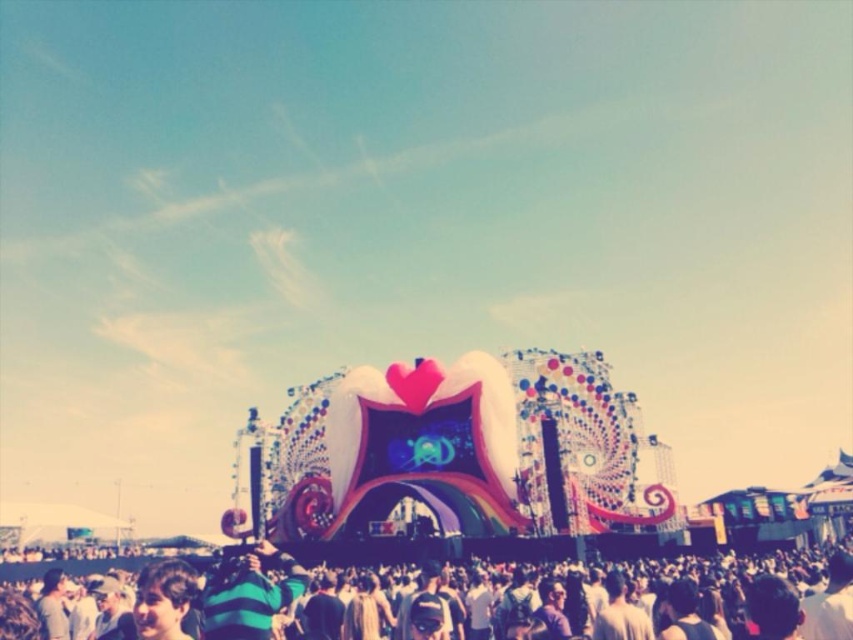
You are a drone operator who needs to fly a drone from the shiny metallic heart at center to the dark gray fabric crowd at lower center. The drone has a maximum flight range of 20 meters. Can the drone complete the flight without needing to recharge?

The shiny metallic heart at center is 22.82 meters from the dark gray fabric crowd at lower center. Since the drone can only fly 20 meters, it cannot complete the flight without needing to recharge.